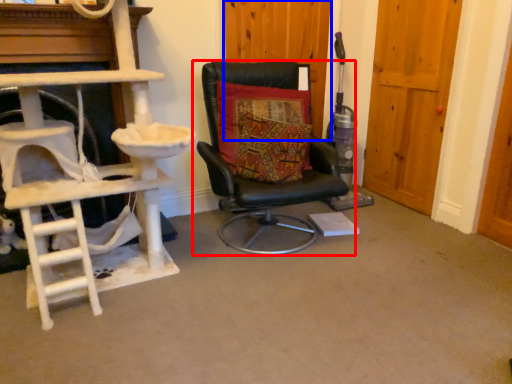
Question: Among these objects, which one is nearest to the camera, chair (highlighted by a red box) or door (highlighted by a blue box)?

Choices:
 (A) chair
 (B) door

Answer: (A)